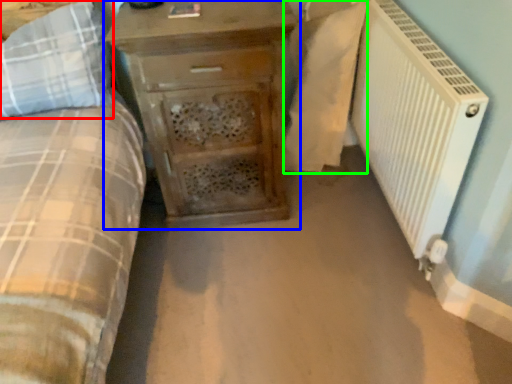
Question: Estimate the real-world distances between objects in this image. Which object is closer to pillow (highlighted by a red box), chest of drawers (highlighted by a blue box) or sheet (highlighted by a green box)?

Choices:
 (A) chest of drawers
 (B) sheet

Answer: (A)